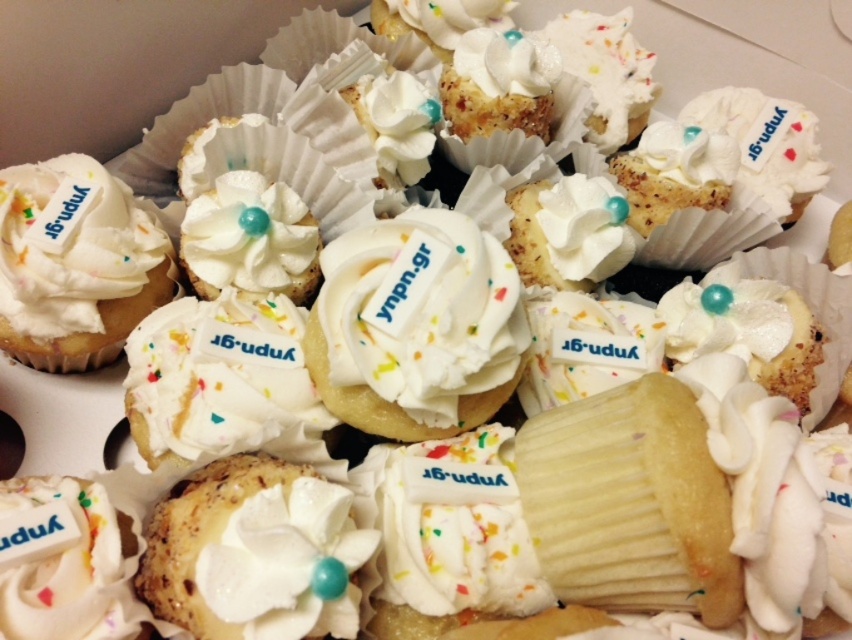
Which of these two, white cream cupcake at center or white matte cupcake at left, stands shorter?

white cream cupcake at center

The width and height of the screenshot is (852, 640). What are the coordinates of `white cream cupcake at center` in the screenshot? It's located at (415, 326).